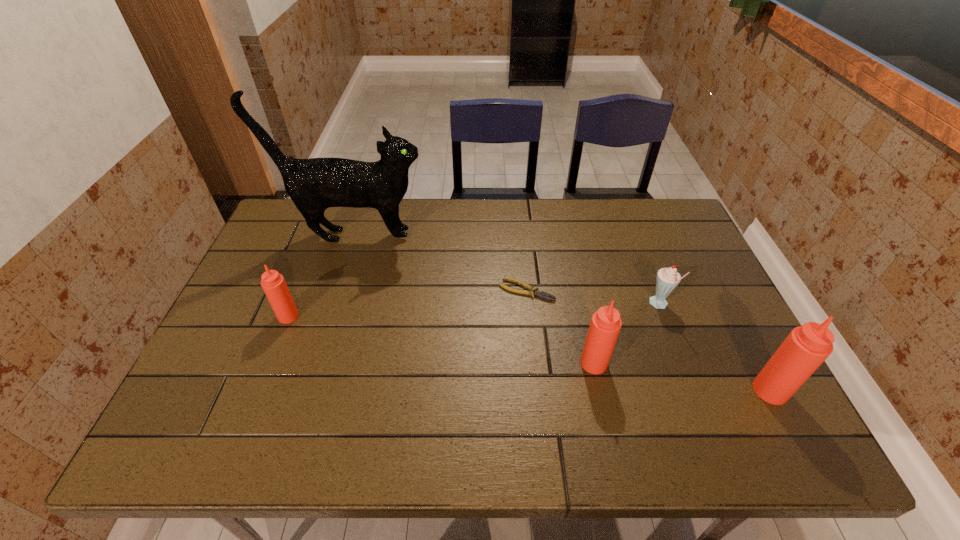
To make them evenly spaced by inserting another Tabasco_sauce among them, please locate a vacant spot for this new Tabasco_sauce. Please provide its 2D coordinates. Your answer should be formatted as a tuple, i.e. [(x, y)], where the tuple contains the x and y coordinates of a point satisfying the conditions above.

[(434, 339)]